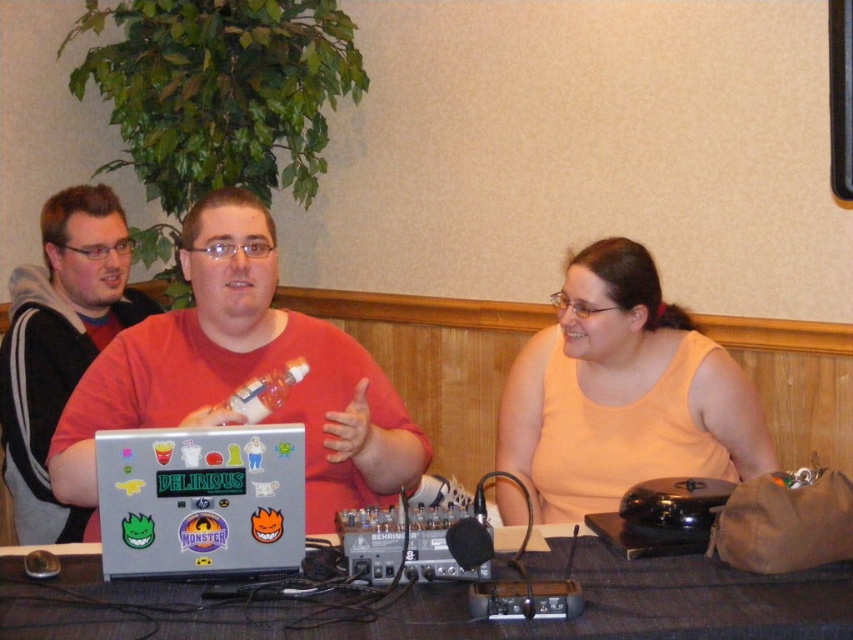
Question: Estimate the real-world distances between objects in this image. Which object is closer to the sticker-covered silver laptop at center?

Choices:
 (A) light orange tank top at center
 (B) matte black hoodie at left
 (C) shiny metallic laptop at center

Answer: (C)

Question: Does shiny metallic laptop at center lie behind sticker-covered silver laptop at center?

Choices:
 (A) no
 (B) yes

Answer: (B)

Question: Among these points, which one is nearest to the camera?

Choices:
 (A) (206, 570)
 (B) (584, 406)
 (C) (161, 620)
 (D) (57, 348)

Answer: (C)

Question: Does shiny metallic laptop at center appear under sticker-covered silver laptop at center?

Choices:
 (A) yes
 (B) no

Answer: (B)

Question: Which point is farther to the camera?

Choices:
 (A) light orange tank top at center
 (B) gray fabric table at center
 (C) sticker-covered silver laptop at center

Answer: (A)

Question: Is gray fabric table at center positioned before matte black hoodie at left?

Choices:
 (A) yes
 (B) no

Answer: (A)